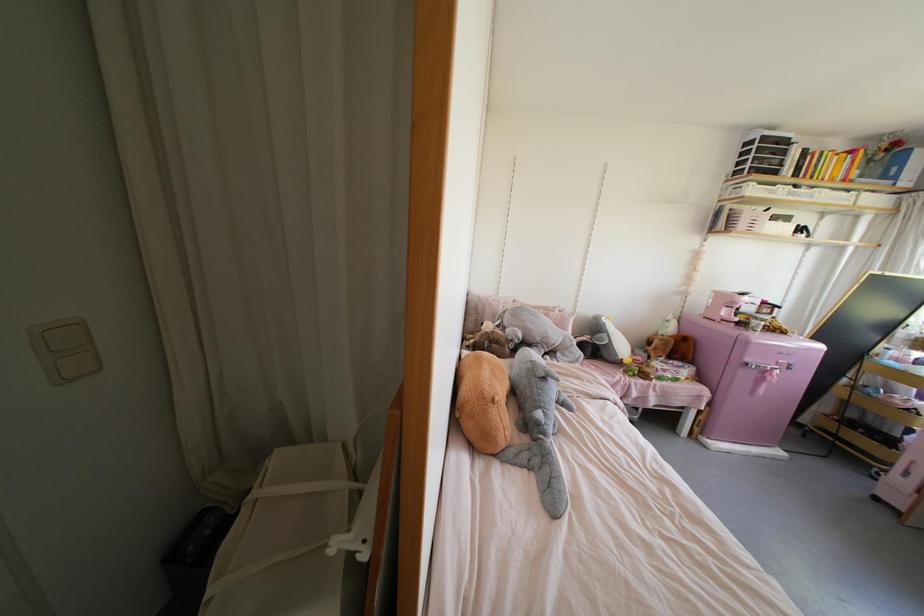
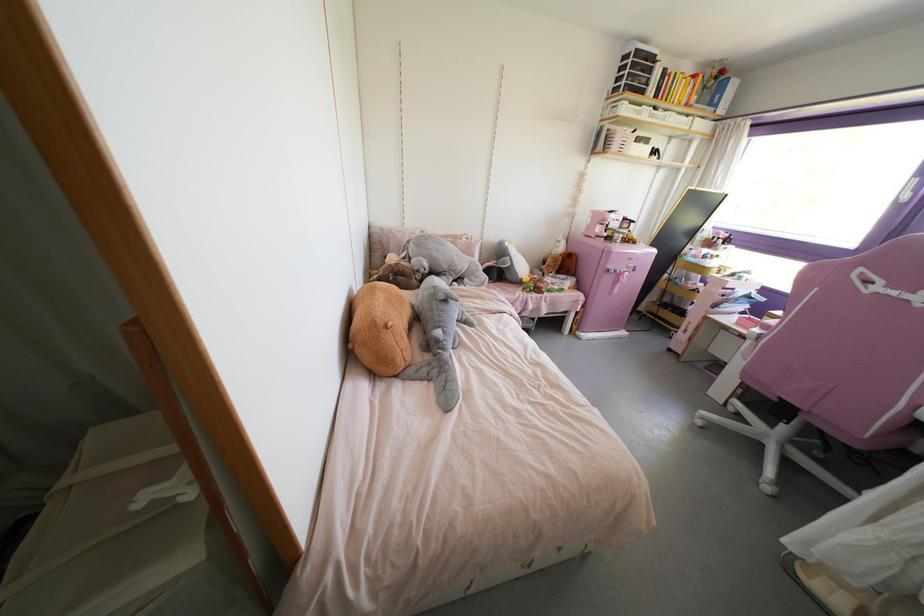
Question: Which direction would the cameraman need to move to produce the second image? Reply with the corresponding letter.

Choices:
 (A) Left
 (B) Right
 (C) Forward
 (D) Backward

Answer: (B)